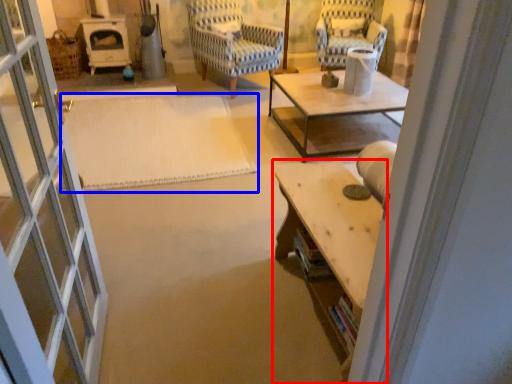
Question: Which object appears closest to the camera in this image, table (highlighted by a red box) or mat (highlighted by a blue box)?

Choices:
 (A) table
 (B) mat

Answer: (A)